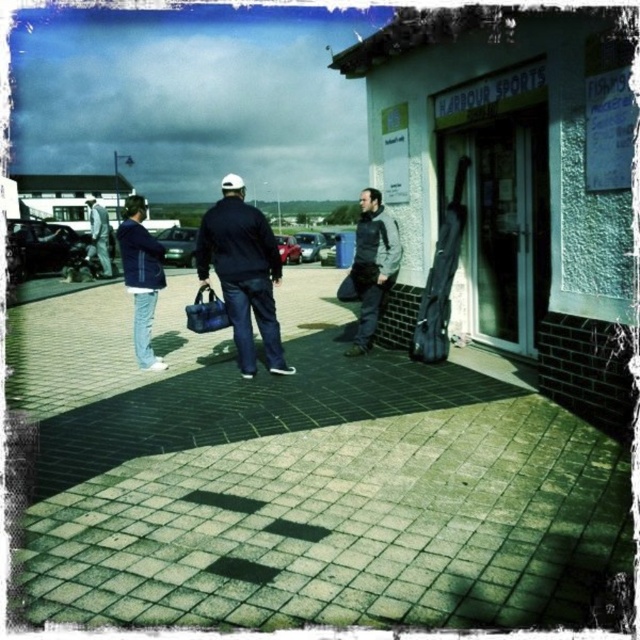
Does green brick pavement at center have a larger size compared to blue fabric bag at center?

Yes, green brick pavement at center is bigger than blue fabric bag at center.

Is point (19, 362) more distant than point (227, 317)?

That is True.

Between point (285, 433) and point (209, 310), which one is positioned behind?

Positioned behind is point (209, 310).

Image resolution: width=640 pixels, height=640 pixels. What are the coordinates of `green brick pavement at center` in the screenshot? It's located at (304, 480).

Between point (365, 337) and point (104, 257), which one is positioned in front?

Point (365, 337)

Between point (358, 200) and point (106, 218), which one is positioned behind?

Positioned behind is point (358, 200).

The height and width of the screenshot is (640, 640). I want to click on dark gray jacket at center, so [372, 266].

Is blue denim jacket at left positioned before blue fabric bag at center?

No, blue denim jacket at left is further to the viewer.

Locate an element on the screen. This screenshot has height=640, width=640. blue denim jacket at left is located at coordinates (140, 276).

Find the location of a particular element. blue denim jacket at left is located at coordinates [140, 276].